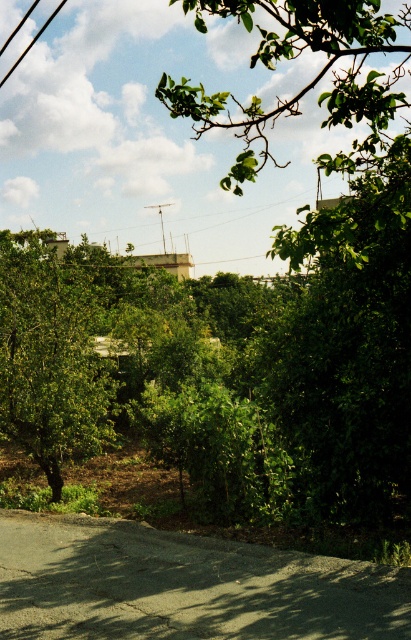
Looking at this image, is green leafy tree at left closer to camera compared to metallic pole at center?

Yes, green leafy tree at left is closer to the viewer.

How distant is green leafy tree at left from metallic pole at center?

green leafy tree at left and metallic pole at center are 19.28 meters apart.

Is point (55, 298) positioned after point (161, 225)?

No, (55, 298) is closer to viewer.

Where is `green leafy tree at left`? This screenshot has height=640, width=411. green leafy tree at left is located at coordinates (50, 356).